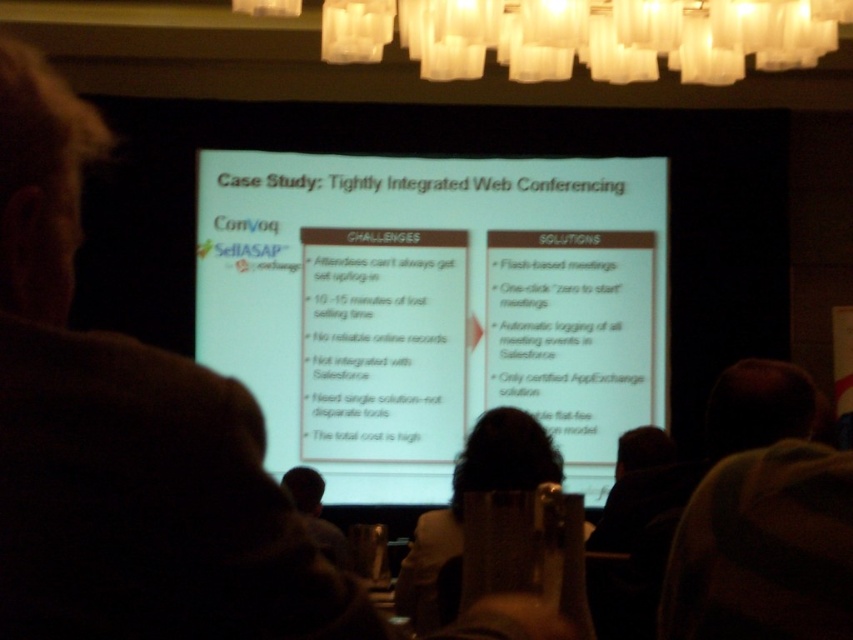
Is point (57, 448) positioned before point (711, 577)?

That is True.

Can you confirm if dark hair at upper left is bigger than brown hair at upper center?

Yes, dark hair at upper left is bigger than brown hair at upper center.

Does point (27, 276) lie behind point (750, 628)?

No, it is not.

This screenshot has width=853, height=640. Identify the location of dark hair at upper left. (126, 442).

From the picture: Is brown hair at upper center below white fabric at center?

Actually, brown hair at upper center is above white fabric at center.

Is brown hair at upper center positioned in front of white fabric at center?

Yes, it is.

Between point (770, 458) and point (525, 476), which one is positioned in front?

Positioned in front is point (770, 458).

The height and width of the screenshot is (640, 853). What are the coordinates of `brown hair at upper center` in the screenshot? It's located at (763, 522).

Can you confirm if dark hair at upper left is wider than white glass chandelier at upper center?

No.

Between dark hair at upper left and white glass chandelier at upper center, which one is positioned lower?

dark hair at upper left is below.

Which is in front, point (39, 112) or point (444, 33)?

Point (39, 112)

Locate an element on the screen. dark hair at upper left is located at coordinates (126, 442).